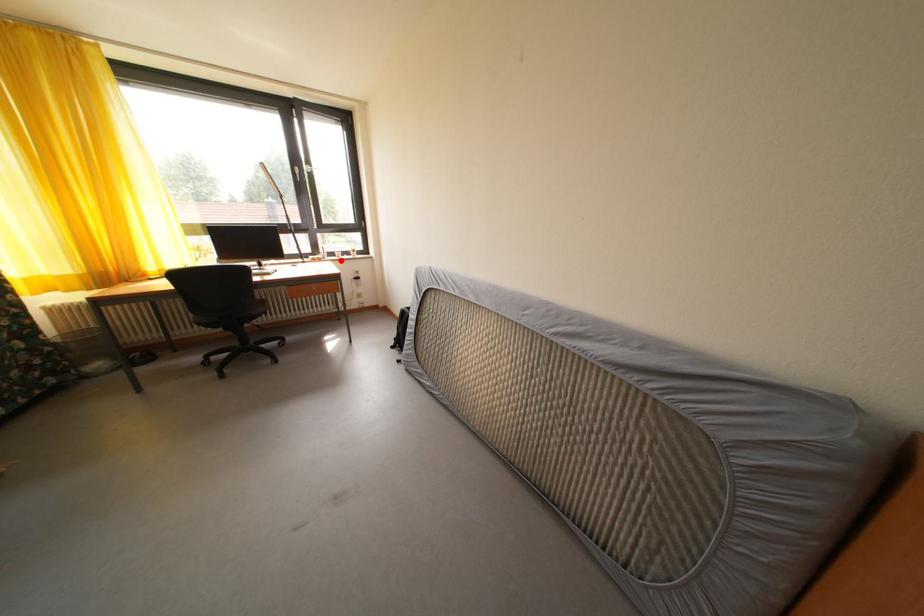
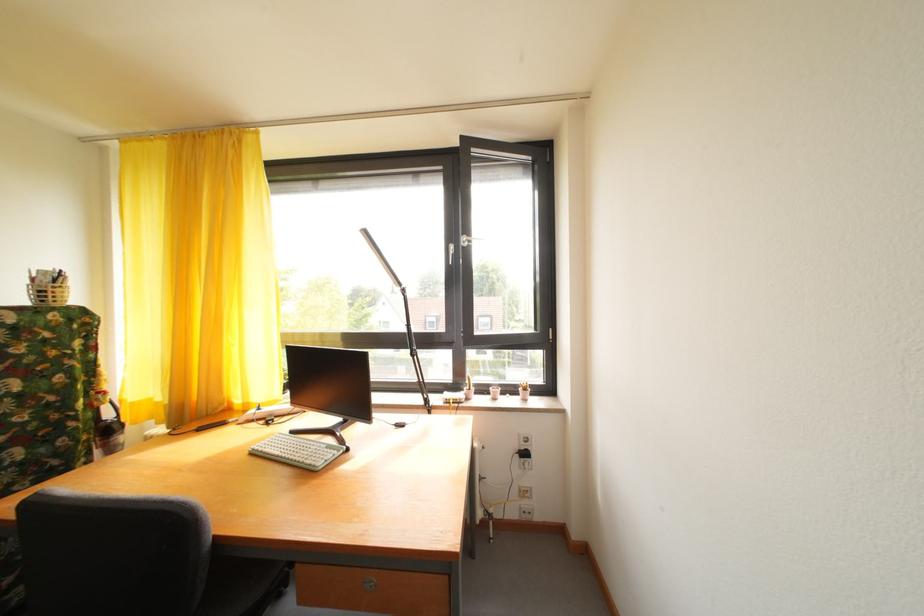
Question: I am providing you with two images of the same scene from different viewpoints. In image1, a red point is highlighted. Considering the same 3D point in image2, which of the following is correct?

Choices:
 (A) It is closer
 (B) It is farther

Answer: (B)